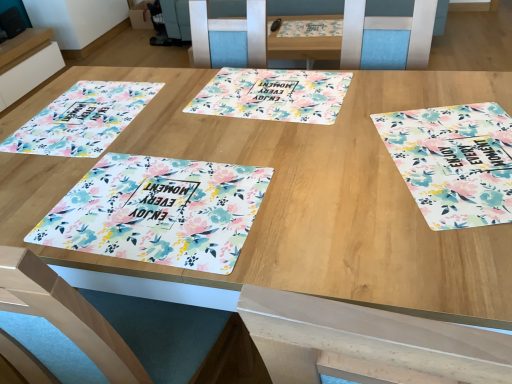
Find the location of a particular element. This screenshot has height=384, width=512. floral fabric placemat at right, which is the third tablecloth in left-to-right order is located at coordinates (454, 162).

In order to face floral printed placemat at lower left, the 2th tablecloth when ordered from left to right, should I rotate leftwards or rightwards?

A 13.364 degree turn to the left will do.

Where is `floral printed placemat at lower left, the 2th tablecloth when ordered from left to right`? This screenshot has width=512, height=384. floral printed placemat at lower left, the 2th tablecloth when ordered from left to right is located at coordinates click(158, 211).

Find the location of `floral fabric placemat at right, which is the third tablecloth in left-to-right order`. floral fabric placemat at right, which is the third tablecloth in left-to-right order is located at coordinates (454, 162).

Is white glossy placemat at upper left further to the viewer compared to floral fabric placemat at right, which is the third tablecloth in left-to-right order?

Yes, it is behind floral fabric placemat at right, which is the third tablecloth in left-to-right order.

Is white glossy placemat at upper left positioned with its back to floral fabric placemat at right, which is the third tablecloth in left-to-right order?

white glossy placemat at upper left does not have its back to floral fabric placemat at right, which is the third tablecloth in left-to-right order.

In the image, is white glossy placemat at upper left on the left side or the right side of floral fabric placemat at right, acting as the first tablecloth starting from the right?

Clearly, white glossy placemat at upper left is on the left of floral fabric placemat at right, acting as the first tablecloth starting from the right, in the image.

How far apart are white glossy placemat at upper left and floral fabric placemat at right, which is the third tablecloth in left-to-right order?

white glossy placemat at upper left and floral fabric placemat at right, which is the third tablecloth in left-to-right order, are 9.13 feet apart from each other.

Is white glossy placemat at upper left in front of floral printed placemat at lower left, the second tablecloth when ordered from right to left?

No, white glossy placemat at upper left is further to the viewer.

From a real-world perspective, which object stands above the other?

From a 3D spatial view, floral printed placemat at lower left, the second tablecloth when ordered from right to left, is above.

Can you tell me how much white glossy placemat at upper left and floral printed placemat at lower left, the 2th tablecloth when ordered from left to right, differ in facing direction?

They differ by 86.3 degrees in their facing directions.

Is white glossy placemat at upper left bigger or smaller than floral printed placemat at lower left, the second tablecloth when ordered from right to left?

white glossy placemat at upper left is bigger than floral printed placemat at lower left, the second tablecloth when ordered from right to left.

Could you tell me if floral printed placemat at center is turned towards floral fabric placemat at right, which is the third tablecloth in left-to-right order?

No, floral printed placemat at center is not aimed at floral fabric placemat at right, which is the third tablecloth in left-to-right order.

Considering the sizes of objects floral printed placemat at center and floral fabric placemat at right, which is the third tablecloth in left-to-right order, in the image provided, who is smaller, floral printed placemat at center or floral fabric placemat at right, which is the third tablecloth in left-to-right order,?

floral fabric placemat at right, which is the third tablecloth in left-to-right order, is smaller.

From a real-world perspective, relative to floral fabric placemat at right, which is the third tablecloth in left-to-right order, is floral printed placemat at center vertically above or below?

From a real-world perspective, floral printed placemat at center is physically below floral fabric placemat at right, which is the third tablecloth in left-to-right order.

How distant is floral printed placemat at center from floral fabric placemat at right, which is the third tablecloth in left-to-right order?

floral printed placemat at center and floral fabric placemat at right, which is the third tablecloth in left-to-right order, are 13.24 inches apart.

Would you consider floral printed placemat at lower left, the 2th tablecloth when ordered from left to right, to be distant from floral fabric placemat at right, acting as the first tablecloth starting from the right?

They are positioned close to each other.

Which of these two, floral printed placemat at lower left, the second tablecloth when ordered from right to left, or floral fabric placemat at right, which is the third tablecloth in left-to-right order, is wider?

floral fabric placemat at right, which is the third tablecloth in left-to-right order, is wider.

Is point (125, 167) positioned in front of point (454, 186)?

That is False.

From a real-world perspective, is floral printed placemat at lower left, the second tablecloth when ordered from right to left, positioned above or below floral fabric placemat at right, acting as the first tablecloth starting from the right?

Clearly, from a real-world perspective, floral printed placemat at lower left, the second tablecloth when ordered from right to left, is above floral fabric placemat at right, acting as the first tablecloth starting from the right.

Is floral fabric placemat at right, which is the third tablecloth in left-to-right order, taller than white glossy placemat at upper left?

No, floral fabric placemat at right, which is the third tablecloth in left-to-right order, is not taller than white glossy placemat at upper left.

How much distance is there between floral fabric placemat at right, which is the third tablecloth in left-to-right order, and white glossy placemat at upper left?

9.13 feet.

Looking at this image, from the image's perspective, between floral fabric placemat at right, which is the third tablecloth in left-to-right order, and white glossy placemat at upper left, who is located below?

floral fabric placemat at right, which is the third tablecloth in left-to-right order, appears lower in the image.

Consider the image. How many degrees apart are the facing directions of floral fabric placemat at right, acting as the first tablecloth starting from the right, and white glossy placemat at upper left?

There is a 107-degree angle between the facing directions of floral fabric placemat at right, acting as the first tablecloth starting from the right, and white glossy placemat at upper left.

Between floral printed placemat at center and floral printed placemat at left, acting as the 1th tablecloth starting from the left, which one is positioned behind?

floral printed placemat at center is further away from the camera.

From the image's perspective, is floral printed placemat at center over floral printed placemat at left, acting as the 1th tablecloth starting from the left?

Yes, from the image's perspective, floral printed placemat at center is on top of floral printed placemat at left, acting as the 1th tablecloth starting from the left.

You are a GUI agent. You are given a task and a screenshot of the screen. Output one action in this format:
    pyautogui.click(x=<x>, y=<y>)
    Task: Click on the yoga mat that appears on the right of floral printed placemat at left, arranged as the 3th tablecloth when viewed from the right
    
    Given the screenshot: What is the action you would take?
    pyautogui.click(x=273, y=95)

From a real-world perspective, is floral printed placemat at center positioned under floral printed placemat at left, acting as the 1th tablecloth starting from the left, based on gravity?

Indeed, from a real-world perspective, floral printed placemat at center is positioned beneath floral printed placemat at left, acting as the 1th tablecloth starting from the left.

At what (x,y) coordinates should I click in order to perform the action: click on the 3rd tablecloth in front of the white glossy placemat at upper left, counting from the anchor's position. Please return your answer as a coordinate pair (x, y). This screenshot has width=512, height=384. Looking at the image, I should click on coord(158,211).

How distant is floral printed placemat at lower left, the 2th tablecloth when ordered from left to right, from white glossy placemat at upper left?

They are 2.44 meters apart.

How many degrees apart are the facing directions of floral printed placemat at lower left, the second tablecloth when ordered from right to left, and white glossy placemat at upper left?

floral printed placemat at lower left, the second tablecloth when ordered from right to left, and white glossy placemat at upper left are facing 86.3 degrees away from each other.

Is point (157, 167) closer to camera compared to point (25, 53)?

Yes, point (157, 167) is closer to viewer.

This screenshot has height=384, width=512. In order to click on table above the floral fabric placemat at right, acting as the first tablecloth starting from the right (from the image's perspective) in this screenshot , I will do `click(28, 64)`.

This screenshot has width=512, height=384. What are the coordinates of `the 3rd tablecloth positioned below the white glossy placemat at upper left (from the image's perspective)` in the screenshot? It's located at coord(158,211).

Which object lies nearer to the anchor point floral printed placemat at left, arranged as the 3th tablecloth when viewed from the right, floral fabric placemat at right, which is the third tablecloth in left-to-right order, or floral printed placemat at center?

floral printed placemat at center is closer to floral printed placemat at left, arranged as the 3th tablecloth when viewed from the right.

Which object lies further to the anchor point white glossy placemat at upper left, floral printed placemat at left, acting as the 1th tablecloth starting from the left, or floral fabric placemat at right, which is the third tablecloth in left-to-right order?

The object further to white glossy placemat at upper left is floral fabric placemat at right, which is the third tablecloth in left-to-right order.

Based on their spatial positions, is floral printed placemat at left, acting as the 1th tablecloth starting from the left, or floral printed placemat at lower left, the 2th tablecloth when ordered from left to right, further from white glossy placemat at upper left?

The object further to white glossy placemat at upper left is floral printed placemat at lower left, the 2th tablecloth when ordered from left to right.

Based on their spatial positions, is floral printed placemat at center or floral printed placemat at left, arranged as the 3th tablecloth when viewed from the right, further from white glossy placemat at upper left?

Among the two, floral printed placemat at center is located further to white glossy placemat at upper left.

When comparing their distances from floral fabric placemat at right, acting as the first tablecloth starting from the right, does white glossy placemat at upper left or floral printed placemat at lower left, the second tablecloth when ordered from right to left, seem closer?

floral printed placemat at lower left, the second tablecloth when ordered from right to left, lies closer to floral fabric placemat at right, acting as the first tablecloth starting from the right, than the other object.

Considering their positions, is floral printed placemat at lower left, the 2th tablecloth when ordered from left to right, positioned further to floral printed placemat at left, arranged as the 3th tablecloth when viewed from the right, than white glossy placemat at upper left?

white glossy placemat at upper left.

Based on their spatial positions, is white glossy placemat at upper left or floral printed placemat at left, arranged as the 3th tablecloth when viewed from the right, closer to floral printed placemat at center?

floral printed placemat at left, arranged as the 3th tablecloth when viewed from the right, is closer to floral printed placemat at center.

Estimate the real-world distances between objects in this image. Which object is closer to floral printed placemat at lower left, the 2th tablecloth when ordered from left to right, floral printed placemat at center or white glossy placemat at upper left?

floral printed placemat at center is closer to floral printed placemat at lower left, the 2th tablecloth when ordered from left to right.

Locate an element on the screen. This screenshot has width=512, height=384. yoga mat located between white glossy placemat at upper left and floral fabric placemat at right, which is the third tablecloth in left-to-right order, in the left-right direction is located at coordinates (273, 95).

Find the location of a particular element. The height and width of the screenshot is (384, 512). yoga mat between floral printed placemat at left, acting as the 1th tablecloth starting from the left, and floral fabric placemat at right, which is the third tablecloth in left-to-right order, from left to right is located at coordinates (273, 95).

Image resolution: width=512 pixels, height=384 pixels. Find the location of `yoga mat positioned between floral printed placemat at lower left, the 2th tablecloth when ordered from left to right, and white glossy placemat at upper left from near to far`. yoga mat positioned between floral printed placemat at lower left, the 2th tablecloth when ordered from left to right, and white glossy placemat at upper left from near to far is located at coordinates (273, 95).

Identify the location of yoga mat between floral printed placemat at lower left, the second tablecloth when ordered from right to left, and floral fabric placemat at right, acting as the first tablecloth starting from the right, from left to right. (273, 95).